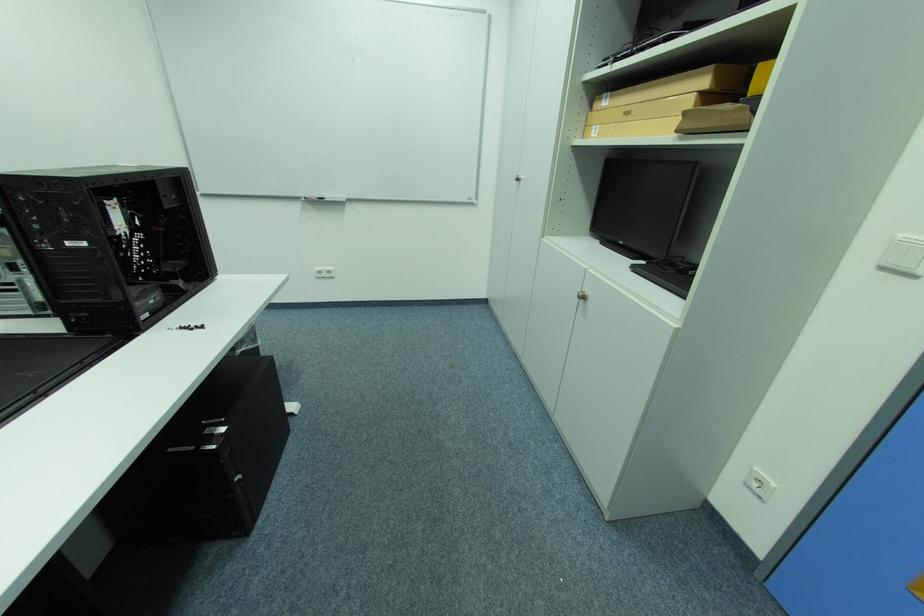
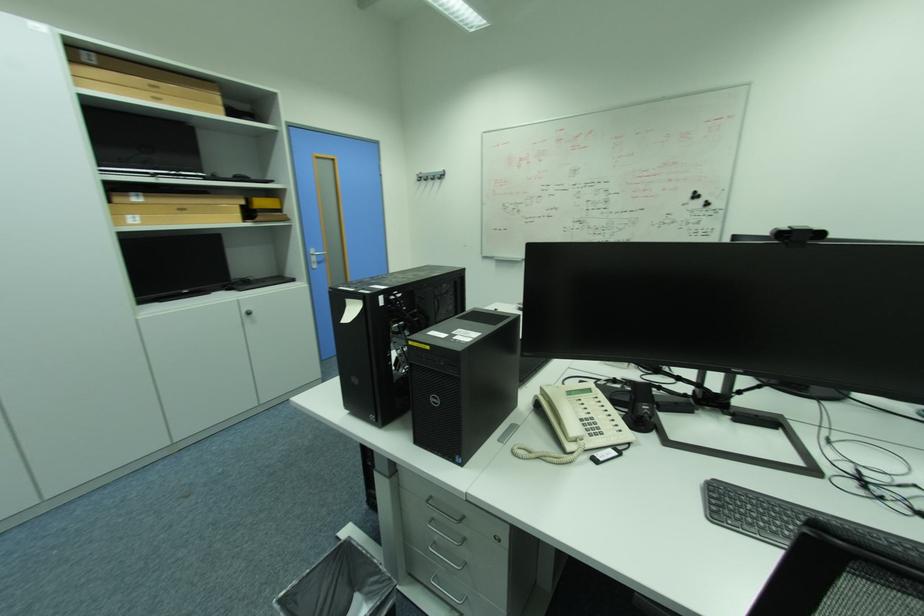
The point at (x=602, y=128) is marked in the first image. Where is the corresponding point in the second image?

(136, 217)